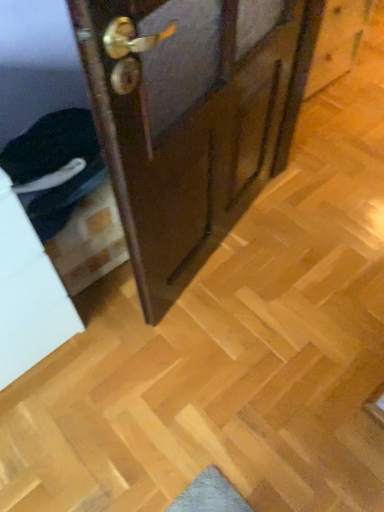
At what (x,y) coordinates should I click in order to perform the action: click on white matte drawer at lower left. Please return your answer as a coordinate pair (x, y). This screenshot has width=384, height=512. Looking at the image, I should click on [x=33, y=319].

What do you see at coordinates (33, 319) in the screenshot? I see `white matte drawer at lower left` at bounding box center [33, 319].

The image size is (384, 512). Describe the element at coordinates (191, 119) in the screenshot. I see `wooden door at center` at that location.

Measure the distance between wooden door at center and camera.

The distance of wooden door at center from camera is 24.19 inches.

Identify the location of wooden door at center. (191, 119).

You are a GUI agent. You are given a task and a screenshot of the screen. Output one action in this format:
    pyautogui.click(x=<x>, y=<y>)
    Task: Click on the white matte drawer at lower left
    This screenshot has width=384, height=512.
    Given the screenshot: What is the action you would take?
    pyautogui.click(x=33, y=319)

Considering the positions of objects wooden door at center and white matte drawer at lower left in the image provided, who is more to the left, wooden door at center or white matte drawer at lower left?

Positioned to the left is white matte drawer at lower left.

Is the depth of wooden door at center greater than that of white matte drawer at lower left?

No, it is in front of white matte drawer at lower left.

Is point (257, 91) positioned in front of point (48, 339)?

Yes, it is in front of point (48, 339).

From the image's perspective, is wooden door at center over white matte drawer at lower left?

Yes, from the image's perspective, wooden door at center is over white matte drawer at lower left.

From a real-world perspective, is wooden door at center physically located above or below white matte drawer at lower left?

From a real-world perspective, wooden door at center is physically above white matte drawer at lower left.

Which of these two, wooden door at center or white matte drawer at lower left, is thinner?

wooden door at center.

Between wooden door at center and white matte drawer at lower left, which one has more height?

Standing taller between the two is wooden door at center.

Does wooden door at center have a smaller size compared to white matte drawer at lower left?

Indeed, wooden door at center has a smaller size compared to white matte drawer at lower left.

Is wooden door at center not within white matte drawer at lower left?

Yes, wooden door at center is not within white matte drawer at lower left.

Are wooden door at center and white matte drawer at lower left located far from each other?

No.

Is white matte drawer at lower left at the back of wooden door at center?

wooden door at center does not have its back to white matte drawer at lower left.

How many degrees apart are the facing directions of wooden door at center and white matte drawer at lower left?

1.7 degrees.

Identify the location of drawer lying behind the wooden door at center. The height and width of the screenshot is (512, 384). (33, 319).

Based on the photo, visually, is white matte drawer at lower left positioned to the left or to the right of wooden door at center?

Clearly, white matte drawer at lower left is on the left of wooden door at center in the image.

Considering the positions of objects white matte drawer at lower left and wooden door at center in the image provided, who is behind, white matte drawer at lower left or wooden door at center?

white matte drawer at lower left is more distant.

Considering the positions of points (50, 267) and (288, 118), is point (50, 267) farther from camera compared to point (288, 118)?

That is False.

Consider the image. From the image's perspective, between white matte drawer at lower left and wooden door at center, who is located below?

white matte drawer at lower left, from the image's perspective.

From a real-world perspective, between white matte drawer at lower left and wooden door at center, who is vertically lower?

In real-world perspective, white matte drawer at lower left is lower.

Which object is thinner, white matte drawer at lower left or wooden door at center?

Thinner between the two is wooden door at center.

Who is taller, white matte drawer at lower left or wooden door at center?

wooden door at center is taller.

Considering the relative sizes of white matte drawer at lower left and wooden door at center in the image provided, is white matte drawer at lower left smaller than wooden door at center?

No.

In the scene shown: Is white matte drawer at lower left not inside wooden door at center?

Indeed, white matte drawer at lower left is completely outside wooden door at center.

Are white matte drawer at lower left and wooden door at center located far from each other?

No.

Is white matte drawer at lower left oriented away from wooden door at center?

That's not correct — white matte drawer at lower left is not looking away from wooden door at center.

Measure the distance between white matte drawer at lower left and wooden door at center.

They are 20.39 inches apart.

Where is `door located above the white matte drawer at lower left (from the image's perspective)`? door located above the white matte drawer at lower left (from the image's perspective) is located at coordinates (191, 119).

The height and width of the screenshot is (512, 384). I want to click on door lying in front of the white matte drawer at lower left, so click(191, 119).

Locate an element on the screen. Image resolution: width=384 pixels, height=512 pixels. drawer below the wooden door at center (from a real-world perspective) is located at coordinates (33, 319).